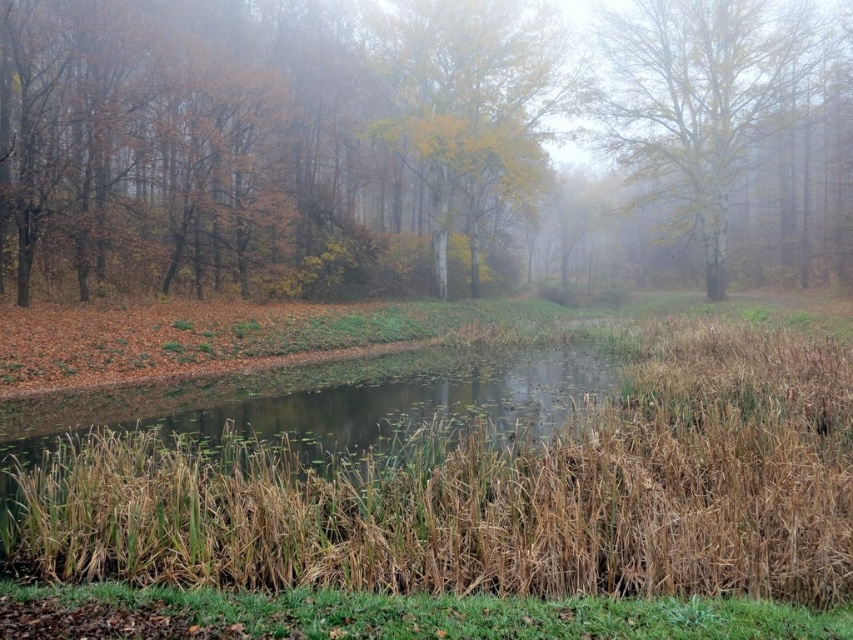
Question: Which object is farther from the camera taking this photo?

Choices:
 (A) brown dry reed at center
 (B) yellow-green foliage at center
 (C) yellow-green leaves at center
 (D) yellowish-brown bark tree at upper right

Answer: (C)

Question: Can you confirm if yellow-green foliage at center is wider than yellow-green leaves at center?

Choices:
 (A) no
 (B) yes

Answer: (B)

Question: Is yellow-green foliage at center in front of yellow-green leaves at center?

Choices:
 (A) yes
 (B) no

Answer: (A)

Question: Among these points, which one is farthest from the camera?

Choices:
 (A) (221, 276)
 (B) (422, 172)
 (C) (697, 84)
 (D) (755, 362)

Answer: (B)

Question: Does yellow-green foliage at center come behind yellowish-brown bark tree at upper right?

Choices:
 (A) yes
 (B) no

Answer: (B)

Question: Which of the following is the closest to the observer?

Choices:
 (A) (200, 173)
 (B) (688, 44)
 (C) (466, 112)

Answer: (A)